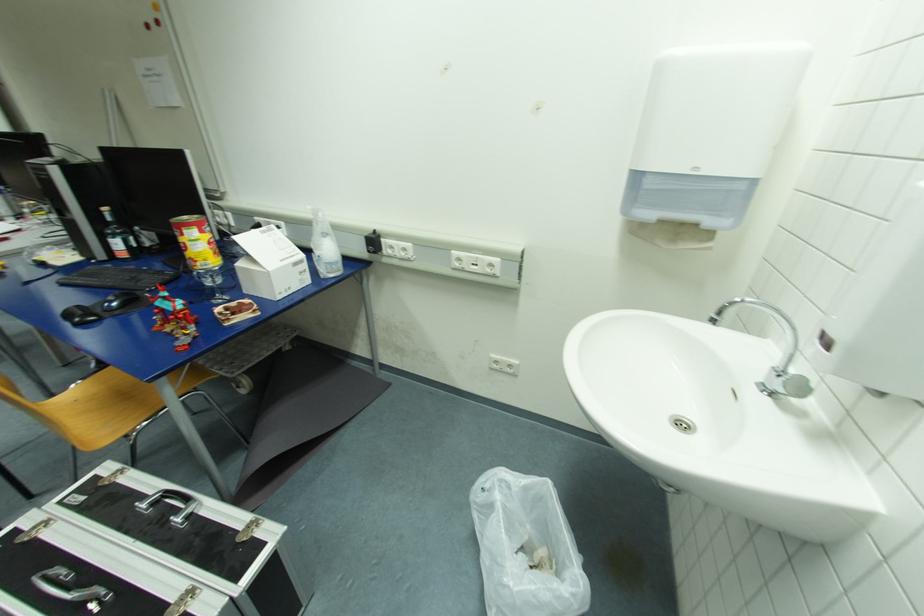
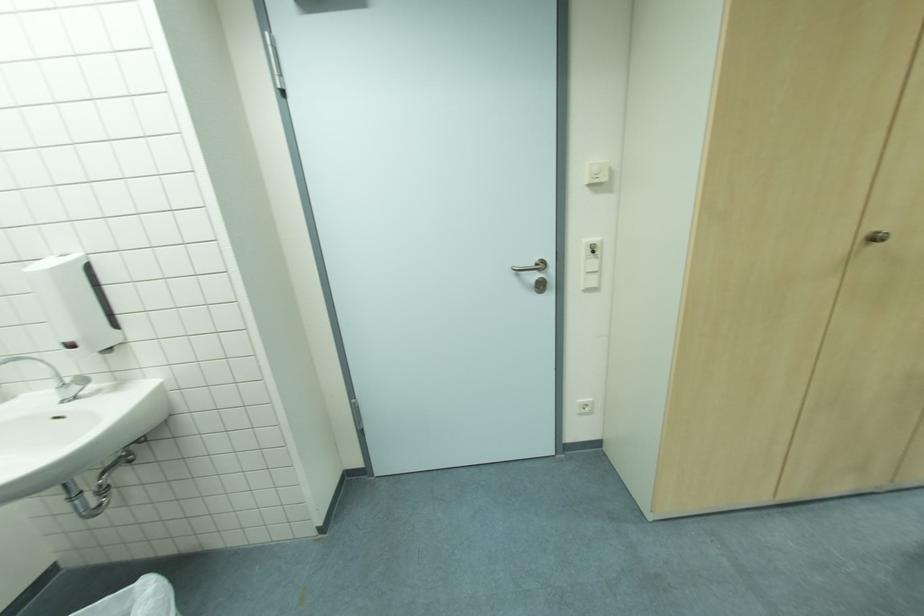
First-person continuous shooting, in which direction is the camera rotating?

The camera's rotation is toward right-down.